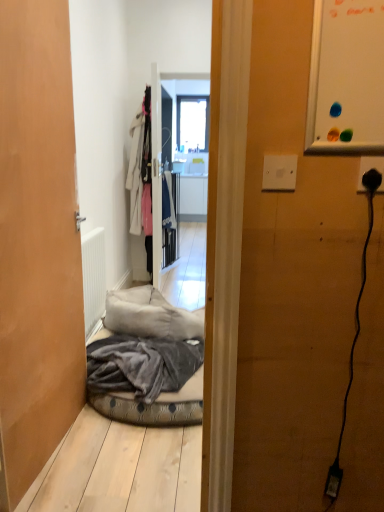
The image size is (384, 512). What do you see at coordinates (371, 168) in the screenshot? I see `black plastic plug at right` at bounding box center [371, 168].

Where is `black plastic plug at right`? This screenshot has height=512, width=384. black plastic plug at right is located at coordinates (371, 168).

You are a GUI agent. You are given a task and a screenshot of the screen. Output one action in this format:
    pyautogui.click(x=<x>, y=<y>)
    Task: Click on the wooden door at left
    This screenshot has height=512, width=384.
    Given the screenshot: What is the action you would take?
    (37, 242)

Is point (22, 192) positioned after point (382, 176)?

Yes.

Which of these two, wooden door at left or black plastic plug at right, is wider?

Wider between the two is wooden door at left.

Who is smaller, wooden door at left or black plastic plug at right?

black plastic plug at right is smaller.

Who is smaller, black plastic plug at right or white matte radiator at left?

Smaller between the two is black plastic plug at right.

Is black plastic plug at right beside white matte radiator at left?

black plastic plug at right and white matte radiator at left are clearly separated.

Is black plastic plug at right facing towards white matte radiator at left?

No, black plastic plug at right does not turn towards white matte radiator at left.

Is white matte radiator at left surrounding transparent glass window at center?

Actually, transparent glass window at center is outside white matte radiator at left.

From the image's perspective, is white matte radiator at left located above or below transparent glass window at center?

Based on their image positions, white matte radiator at left is located beneath transparent glass window at center.

Is white matte radiator at left oriented away from transparent glass window at center?

No, white matte radiator at left is not facing away from transparent glass window at center.

From a real-world perspective, is white matte radiator at left physically located above or below transparent glass window at center?

white matte radiator at left is situated lower than transparent glass window at center in the real world.

Is white fabric coat at center situated inside transparent glass window at center or outside?

white fabric coat at center cannot be found inside transparent glass window at center.

Could you tell me if white fabric coat at center is facing transparent glass window at center?

No, white fabric coat at center is not oriented towards transparent glass window at center.

Are white fabric coat at center and transparent glass window at center making contact?

They are not placed beside each other.

At what (x,y) coordinates should I click in order to perform the action: click on clothing that appears below the transparent glass window at center (from the image's perspective). Please return your answer as a coordinate pair (x, y). Looking at the image, I should click on (141, 177).

Find the location of a particular element. The height and width of the screenshot is (512, 384). radiator behind the wooden door at left is located at coordinates (93, 279).

In terms of size, does wooden door at left appear bigger or smaller than white matte radiator at left?

wooden door at left is bigger than white matte radiator at left.

Considering the positions of objects wooden door at left and white matte radiator at left in the image provided, who is more to the left, wooden door at left or white matte radiator at left?

From the viewer's perspective, white matte radiator at left appears more on the left side.

You are a GUI agent. You are given a task and a screenshot of the screen. Output one action in this format:
    pyautogui.click(x=<x>, y=<y>)
    Task: Click on the radiator below the white fabric coat at center (from a real-world perspective)
    Image resolution: width=384 pixels, height=512 pixels.
    Given the screenshot: What is the action you would take?
    pyautogui.click(x=93, y=279)

Looking at this image, does white fabric coat at center turn towards white matte radiator at left?

No.

Choose the correct answer: Is white fabric coat at center inside white matte radiator at left or outside it?

white fabric coat at center is outside white matte radiator at left.

Is white fabric coat at center placed right next to white matte radiator at left?

No, white fabric coat at center is not in contact with white matte radiator at left.

Is point (185, 109) more distant than point (139, 223)?

Yes, it is.

Would you consider transparent glass window at center to be distant from white fabric coat at center?

Yes, transparent glass window at center and white fabric coat at center are located far from each other.

Does transparent glass window at center turn towards white fabric coat at center?

Yes, transparent glass window at center is oriented towards white fabric coat at center.

In the scene shown: Is the position of transparent glass window at center less distant than that of white fabric coat at center?

No, it is behind white fabric coat at center.

In the image, there is a black plastic plug at right. At what (x,y) coordinates should I click in order to perform the action: click on door below it (from the image's perspective). Please return your answer as a coordinate pair (x, y). The height and width of the screenshot is (512, 384). Looking at the image, I should click on (37, 242).

Locate an element on the screen. The height and width of the screenshot is (512, 384). electric outlet on the right side of white matte radiator at left is located at coordinates (371, 168).

Looking at this image, which object lies further to the anchor point wooden door at left, transparent glass window at center or white matte radiator at left?

transparent glass window at center.

Consider the image. When comparing their distances from white matte radiator at left, does white fabric coat at center or transparent glass window at center seem further?

transparent glass window at center is further to white matte radiator at left.

Based on their spatial positions, is white matte radiator at left or black plastic plug at right further from wooden door at left?

black plastic plug at right.

Which object lies further to the anchor point black plastic plug at right, wooden door at left or white matte radiator at left?

white matte radiator at left is positioned further to the anchor black plastic plug at right.

Based on their spatial positions, is black plastic plug at right or white fabric coat at center closer to white matte radiator at left?

white fabric coat at center.

Which object lies nearer to the anchor point black plastic plug at right, wooden door at left or white fabric coat at center?

Based on the image, wooden door at left appears to be nearer to black plastic plug at right.

Which object lies nearer to the anchor point transparent glass window at center, white matte radiator at left or black plastic plug at right?

Based on the image, white matte radiator at left appears to be nearer to transparent glass window at center.

When comparing their distances from wooden door at left, does white matte radiator at left or white fabric coat at center seem further?

white fabric coat at center lies further to wooden door at left than the other object.

Find the location of a particular element. The width and height of the screenshot is (384, 512). radiator between black plastic plug at right and transparent glass window at center in the front-back direction is located at coordinates (93, 279).

Image resolution: width=384 pixels, height=512 pixels. Identify the location of electric outlet located between wooden door at left and white matte radiator at left in the depth direction. (371, 168).

In order to click on electric outlet located between wooden door at left and white fabric coat at center in the depth direction in this screenshot , I will do coord(371,168).

Image resolution: width=384 pixels, height=512 pixels. I want to click on radiator between wooden door at left and transparent glass window at center in the front-back direction, so click(93, 279).